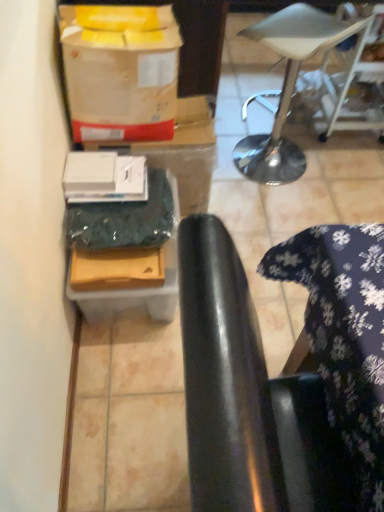
In order to click on matte brown cardboard box at lower left, positioned as the 2th cardboard box in back-to-front order in this screenshot , I will do `click(117, 269)`.

I want to click on matte cardboard wrapping paper at upper left, so click(120, 71).

What do you see at coordinates (284, 378) in the screenshot? I see `black leather chair at lower right` at bounding box center [284, 378].

Locate an element on the screen. The width and height of the screenshot is (384, 512). matte brown cardboard box at lower left, the 1th cardboard box positioned from the front is located at coordinates (117, 269).

From a real-world perspective, is matte cardboard wrapping paper at upper left on top of matte brown cardboard box at lower left, positioned as the 2th cardboard box in back-to-front order?

Correct, in the physical world, matte cardboard wrapping paper at upper left is higher than matte brown cardboard box at lower left, positioned as the 2th cardboard box in back-to-front order.

Is matte cardboard wrapping paper at upper left thinner than matte brown cardboard box at lower left, positioned as the 2th cardboard box in back-to-front order?

Incorrect, the width of matte cardboard wrapping paper at upper left is not less than that of matte brown cardboard box at lower left, positioned as the 2th cardboard box in back-to-front order.

Is point (132, 41) closer to viewer compared to point (135, 250)?

Yes, it is.

Is matte cardboard wrapping paper at upper left to the left of matte brown cardboard box at lower left, the 1th cardboard box positioned from the front, from the viewer's perspective?

In fact, matte cardboard wrapping paper at upper left is to the right of matte brown cardboard box at lower left, the 1th cardboard box positioned from the front.

Find the location of a particular element. This screenshot has width=384, height=512. wrapping paper above the matte brown cardboard box at lower left, the 1th cardboard box positioned from the front (from a real-world perspective) is located at coordinates (120, 71).

Is matte brown cardboard box at lower left, the 1th cardboard box positioned from the front, looking in the opposite direction of matte cardboard wrapping paper at upper left?

That's not correct — matte brown cardboard box at lower left, the 1th cardboard box positioned from the front, is not looking away from matte cardboard wrapping paper at upper left.

From a real-world perspective, is matte brown cardboard box at lower left, the 1th cardboard box positioned from the front, physically above matte cardboard wrapping paper at upper left?

No, from a real-world perspective, matte brown cardboard box at lower left, the 1th cardboard box positioned from the front, is not above matte cardboard wrapping paper at upper left.

In the image, is matte brown cardboard box at lower left, positioned as the 2th cardboard box in back-to-front order, on the left side or the right side of matte cardboard wrapping paper at upper left?

matte brown cardboard box at lower left, positioned as the 2th cardboard box in back-to-front order, is positioned on matte cardboard wrapping paper at upper left's left side.

How different are the orientations of matte brown cardboard box at lower left, positioned as the 2th cardboard box in back-to-front order, and black leather chair at lower right in degrees?

0.49 degrees.

Which object is positioned more to the right, matte brown cardboard box at lower left, positioned as the 2th cardboard box in back-to-front order, or black leather chair at lower right?

From the viewer's perspective, black leather chair at lower right appears more on the right side.

Is point (138, 249) farther from viewer compared to point (317, 344)?

That is True.

Measure the distance from matte brown cardboard box at lower left, positioned as the 2th cardboard box in back-to-front order, to black leather chair at lower right.

A distance of 58.08 centimeters exists between matte brown cardboard box at lower left, positioned as the 2th cardboard box in back-to-front order, and black leather chair at lower right.

Considering the points (123, 298) and (310, 472), which point is behind, point (123, 298) or point (310, 472)?

Point (123, 298)

Considering the positions of objects matte green cardboard box at lower left, which is the 1th cardboard box in back-to-front order, and black leather chair at lower right in the image provided, who is more to the left, matte green cardboard box at lower left, which is the 1th cardboard box in back-to-front order, or black leather chair at lower right?

From the viewer's perspective, matte green cardboard box at lower left, which is the 1th cardboard box in back-to-front order, appears more on the left side.

Which of these two, matte green cardboard box at lower left, which is the 1th cardboard box in back-to-front order, or black leather chair at lower right, is thinner?

matte green cardboard box at lower left, which is the 1th cardboard box in back-to-front order, is thinner.

From a real-world perspective, is white leather stool at upper right beneath black leather chair at lower right?

Correct, in the physical world, white leather stool at upper right is lower than black leather chair at lower right.

Is white leather stool at upper right far from black leather chair at lower right?

white leather stool at upper right is positioned a significant distance from black leather chair at lower right.

From the image's perspective, who appears lower, white leather stool at upper right or black leather chair at lower right?

black leather chair at lower right appears lower in the image.

Based on the photo, is white leather stool at upper right facing towards black leather chair at lower right?

No, white leather stool at upper right is not oriented towards black leather chair at lower right.

From the image's perspective, is matte cardboard wrapping paper at upper left located above or below black leather chair at lower right?

Clearly, from the image's perspective, matte cardboard wrapping paper at upper left is above black leather chair at lower right.

Between matte cardboard wrapping paper at upper left and black leather chair at lower right, which one is positioned in front?

black leather chair at lower right is more forward.

Is matte cardboard wrapping paper at upper left situated inside black leather chair at lower right or outside?

matte cardboard wrapping paper at upper left is not inside black leather chair at lower right, it's outside.

Which object is positioned more to the right, matte green cardboard box at lower left, acting as the 2th cardboard box starting from the front, or matte brown cardboard box at lower left, the 1th cardboard box positioned from the front?

matte green cardboard box at lower left, acting as the 2th cardboard box starting from the front, is more to the right.

Does matte green cardboard box at lower left, acting as the 2th cardboard box starting from the front, have a lesser width compared to matte brown cardboard box at lower left, positioned as the 2th cardboard box in back-to-front order?

Incorrect, the width of matte green cardboard box at lower left, acting as the 2th cardboard box starting from the front, is not less than that of matte brown cardboard box at lower left, positioned as the 2th cardboard box in back-to-front order.

Would you consider matte green cardboard box at lower left, which is the 1th cardboard box in back-to-front order, to be distant from matte brown cardboard box at lower left, the 1th cardboard box positioned from the front?

That's not correct — matte green cardboard box at lower left, which is the 1th cardboard box in back-to-front order, is a little close to matte brown cardboard box at lower left, the 1th cardboard box positioned from the front.

Does matte green cardboard box at lower left, which is the 1th cardboard box in back-to-front order, contain matte brown cardboard box at lower left, positioned as the 2th cardboard box in back-to-front order?

No, matte brown cardboard box at lower left, positioned as the 2th cardboard box in back-to-front order, is not a part of matte green cardboard box at lower left, which is the 1th cardboard box in back-to-front order.

You are a GUI agent. You are given a task and a screenshot of the screen. Output one action in this format:
    pyautogui.click(x=<x>, y=<y>)
    Task: Click on the wrapping paper to the right of matte brown cardboard box at lower left, the 1th cardboard box positioned from the front
    The height and width of the screenshot is (512, 384).
    Given the screenshot: What is the action you would take?
    pyautogui.click(x=120, y=71)

In order to click on the 1st cardboard box behind the matte cardboard wrapping paper at upper left in this screenshot , I will do `click(117, 269)`.

Based on the photo, based on their spatial positions, is matte green cardboard box at lower left, which is the 1th cardboard box in back-to-front order, or black leather chair at lower right closer to white leather stool at upper right?

Based on the image, matte green cardboard box at lower left, which is the 1th cardboard box in back-to-front order, appears to be nearer to white leather stool at upper right.

Based on their spatial positions, is matte cardboard wrapping paper at upper left or matte brown cardboard box at lower left, the 1th cardboard box positioned from the front, closer to matte green cardboard box at lower left, acting as the 2th cardboard box starting from the front?

Based on the image, matte brown cardboard box at lower left, the 1th cardboard box positioned from the front, appears to be nearer to matte green cardboard box at lower left, acting as the 2th cardboard box starting from the front.

Looking at the image, which one is located further to matte cardboard wrapping paper at upper left, white leather stool at upper right or black leather chair at lower right?

Based on the image, white leather stool at upper right appears to be further to matte cardboard wrapping paper at upper left.

Which object lies nearer to the anchor point matte green cardboard box at lower left, which is the 1th cardboard box in back-to-front order, white leather stool at upper right or matte cardboard wrapping paper at upper left?

Based on the image, matte cardboard wrapping paper at upper left appears to be nearer to matte green cardboard box at lower left, which is the 1th cardboard box in back-to-front order.

Looking at the image, which one is located closer to white leather stool at upper right, black leather chair at lower right or matte green cardboard box at lower left, acting as the 2th cardboard box starting from the front?

matte green cardboard box at lower left, acting as the 2th cardboard box starting from the front, is closer to white leather stool at upper right.

Based on their spatial positions, is white leather stool at upper right or black leather chair at lower right closer to matte green cardboard box at lower left, which is the 1th cardboard box in back-to-front order?

Based on the image, black leather chair at lower right appears to be nearer to matte green cardboard box at lower left, which is the 1th cardboard box in back-to-front order.

Estimate the real-world distances between objects in this image. Which object is further from white leather stool at upper right, matte cardboard wrapping paper at upper left or matte brown cardboard box at lower left, positioned as the 2th cardboard box in back-to-front order?

matte brown cardboard box at lower left, positioned as the 2th cardboard box in back-to-front order, lies further to white leather stool at upper right than the other object.

From the picture: Based on their spatial positions, is matte green cardboard box at lower left, acting as the 2th cardboard box starting from the front, or matte cardboard wrapping paper at upper left closer to black leather chair at lower right?

The object closer to black leather chair at lower right is matte green cardboard box at lower left, acting as the 2th cardboard box starting from the front.

Find the location of a particular element. cardboard box between matte cardboard wrapping paper at upper left and matte green cardboard box at lower left, which is the 1th cardboard box in back-to-front order, in the up-down direction is located at coordinates (117, 269).

At what (x,y) coordinates should I click in order to perform the action: click on cardboard box between white leather stool at upper right and matte green cardboard box at lower left, acting as the 2th cardboard box starting from the front, vertically. Please return your answer as a coordinate pair (x, y). Image resolution: width=384 pixels, height=512 pixels. Looking at the image, I should click on (117, 269).

Locate an element on the screen. wrapping paper between black leather chair at lower right and matte brown cardboard box at lower left, positioned as the 2th cardboard box in back-to-front order, from front to back is located at coordinates (120, 71).

Identify the location of wrapping paper between white leather stool at upper right and matte brown cardboard box at lower left, positioned as the 2th cardboard box in back-to-front order, in the vertical direction. (120, 71).